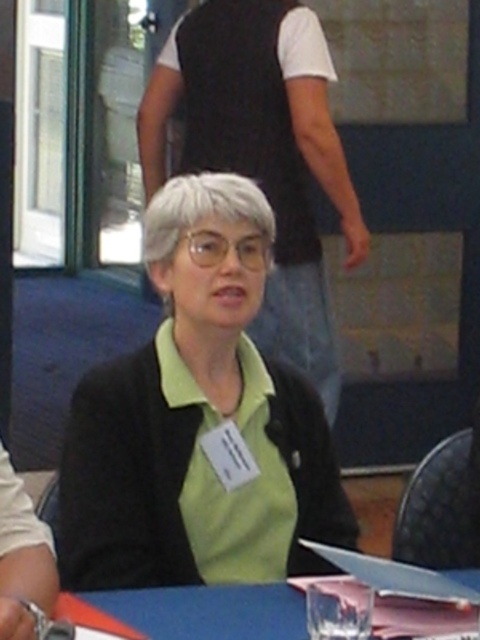
Question: Which point is closer to the camera?

Choices:
 (A) black vest at upper center
 (B) green matte shirt at center
 (C) blue fabric table at lower center

Answer: (C)

Question: Is black vest at upper center thinner than blue fabric table at lower center?

Choices:
 (A) yes
 (B) no

Answer: (B)

Question: Does black vest at upper center have a lesser width compared to blue fabric table at lower center?

Choices:
 (A) yes
 (B) no

Answer: (B)

Question: Which of the following is the closest to the observer?

Choices:
 (A) black vest at upper center
 (B) blue fabric table at lower center
 (C) green matte shirt at center

Answer: (B)

Question: Can you confirm if green matte shirt at center is positioned to the left of black vest at upper center?

Choices:
 (A) no
 (B) yes

Answer: (B)

Question: Which object is farther from the camera taking this photo?

Choices:
 (A) green matte shirt at center
 (B) blue fabric table at lower center

Answer: (A)